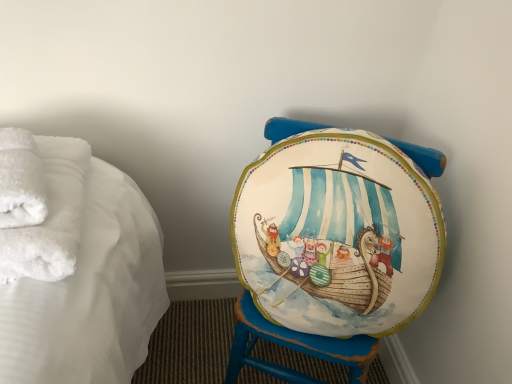
Question: Is white fluffy towels at left, the 1th bath towel positioned from the back, surrounding matte painted stool at center?

Choices:
 (A) no
 (B) yes

Answer: (A)

Question: Does white fluffy towels at left, the 2th bath towel positioned from the front, lie in front of matte painted stool at center?

Choices:
 (A) no
 (B) yes

Answer: (B)

Question: From a real-world perspective, is white fluffy towels at left, the 2th bath towel positioned from the front, on matte painted stool at center?

Choices:
 (A) no
 (B) yes

Answer: (B)

Question: Considering the relative sizes of white fluffy towels at left, the 1th bath towel positioned from the back, and matte painted stool at center in the image provided, is white fluffy towels at left, the 1th bath towel positioned from the back, bigger than matte painted stool at center?

Choices:
 (A) yes
 (B) no

Answer: (B)

Question: Is the position of white fluffy towels at left, the 1th bath towel positioned from the back, more distant than that of matte painted stool at center?

Choices:
 (A) yes
 (B) no

Answer: (B)

Question: From the image's perspective, is white fluffy towels at left, the 2th bath towel positioned from the front, positioned above or below white fluffy bath towel at left, the 2th bath towel in the back-to-front sequence?

Choices:
 (A) below
 (B) above

Answer: (A)

Question: Is white fluffy towels at left, the 1th bath towel positioned from the back, to the left or to the right of white fluffy bath towel at left, the 2th bath towel in the back-to-front sequence, in the image?

Choices:
 (A) left
 (B) right

Answer: (B)

Question: Is point (69, 182) closer or farther from the camera than point (39, 213)?

Choices:
 (A) closer
 (B) farther

Answer: (B)

Question: Do you think white fluffy towels at left, the 1th bath towel positioned from the back, is within white fluffy bath towel at left, marked as the 1th bath towel in a front-to-back arrangement, or outside of it?

Choices:
 (A) inside
 (B) outside

Answer: (B)

Question: Is matte painted stool at center bigger or smaller than white fluffy towels at left, the 2th bath towel positioned from the front?

Choices:
 (A) big
 (B) small

Answer: (A)

Question: Which is correct: matte painted stool at center is inside white fluffy towels at left, the 1th bath towel positioned from the back, or outside of it?

Choices:
 (A) inside
 (B) outside

Answer: (B)

Question: Is matte painted stool at center to the left or to the right of white fluffy towels at left, the 1th bath towel positioned from the back, in the image?

Choices:
 (A) left
 (B) right

Answer: (B)

Question: Considering the positions of matte painted stool at center and white fluffy towels at left, the 1th bath towel positioned from the back, in the image, is matte painted stool at center wider or thinner than white fluffy towels at left, the 1th bath towel positioned from the back,?

Choices:
 (A) thin
 (B) wide

Answer: (B)

Question: Is matte painted stool at center bigger or smaller than white fluffy bath towel at left, the 2th bath towel in the back-to-front sequence?

Choices:
 (A) small
 (B) big

Answer: (B)

Question: Based on their positions, is matte painted stool at center located to the left or right of white fluffy bath towel at left, marked as the 1th bath towel in a front-to-back arrangement?

Choices:
 (A) right
 (B) left

Answer: (A)